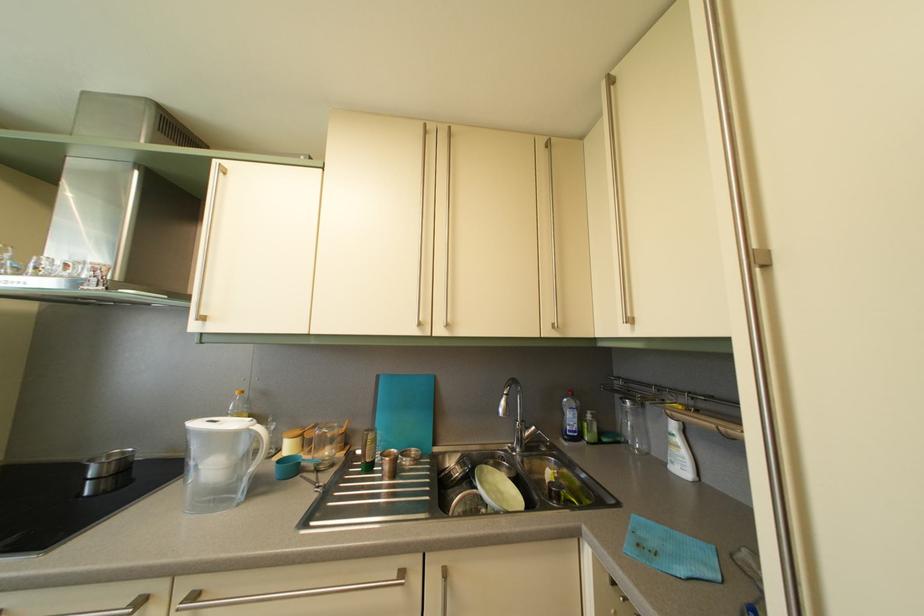
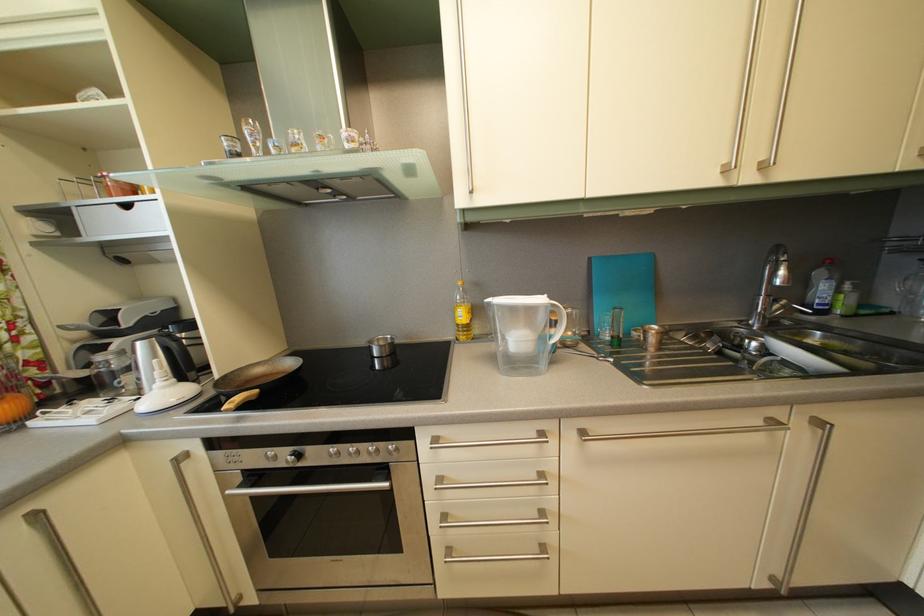
Question: The images are taken continuously from a first-person perspective. In which direction is your viewpoint rotating?

Choices:
 (A) Left
 (B) Right
 (C) Up
 (D) Down

Answer: (D)